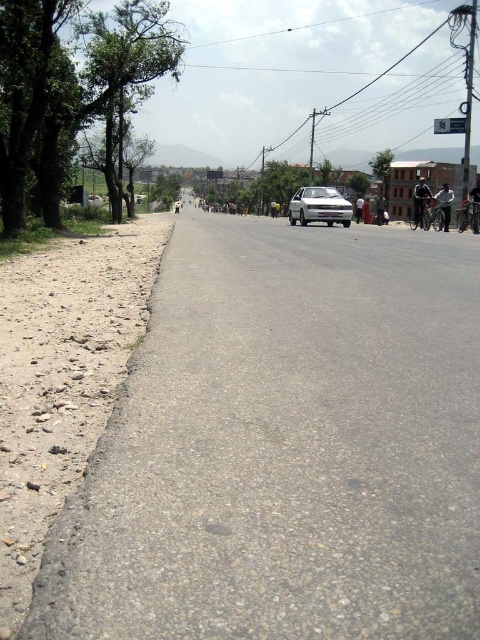
Question: Which point is farther from the camera taking this photo?

Choices:
 (A) (380, 170)
 (B) (166, 189)
 (C) (118, 20)
 (D) (365, 180)

Answer: (B)

Question: Is green leafy tree at upper center bigger than green leafy tree at right?

Choices:
 (A) no
 (B) yes

Answer: (A)

Question: Which object is positioned farthest from the green leafy tree at left?

Choices:
 (A) white matte car at center
 (B) green leafy tree at upper center
 (C) green leafy tree at center
 (D) green leafy tree at right

Answer: (B)

Question: Which point is closer to the camera?

Choices:
 (A) (64, 74)
 (B) (354, 173)
 (C) (162, 172)

Answer: (A)

Question: Does green leafy tree at left appear on the right side of green leafy tree at upper center?

Choices:
 (A) no
 (B) yes

Answer: (B)

Question: Is white matte car at center positioned at the back of green leafy tree at center?

Choices:
 (A) yes
 (B) no

Answer: (B)